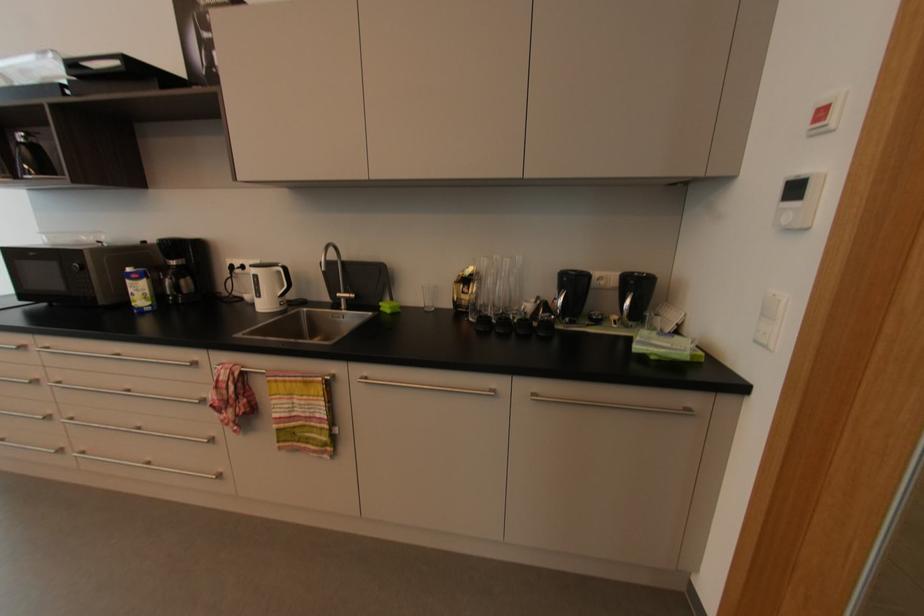
This screenshot has height=616, width=924. What do you see at coordinates (261, 371) in the screenshot? I see `the towel rack handle` at bounding box center [261, 371].